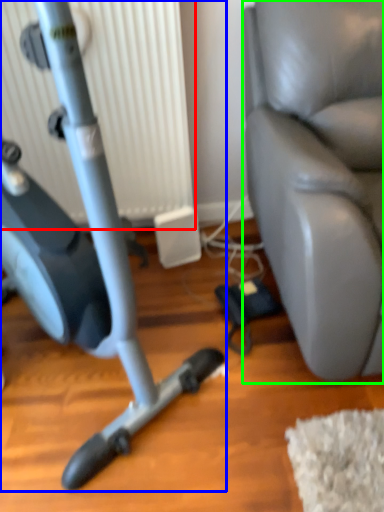
Question: Estimate the real-world distances between objects in this image. Which object is farther from radiator (highlighted by a red box), stationary bicycle (highlighted by a blue box) or swivel chair (highlighted by a green box)?

Choices:
 (A) stationary bicycle
 (B) swivel chair

Answer: (A)